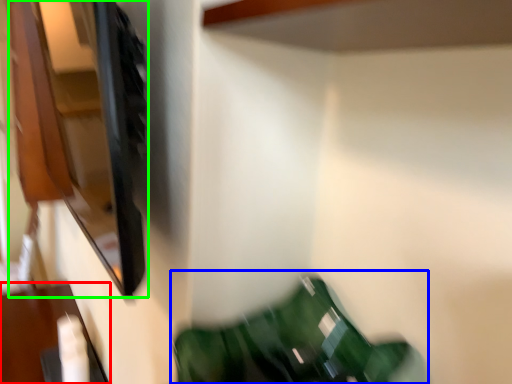
Question: Based on their relative distances, which object is nearer to furniture (highlighted by a red box)? Choose from bean bag chair (highlighted by a blue box) and cabinet (highlighted by a green box).

Choices:
 (A) bean bag chair
 (B) cabinet

Answer: (A)